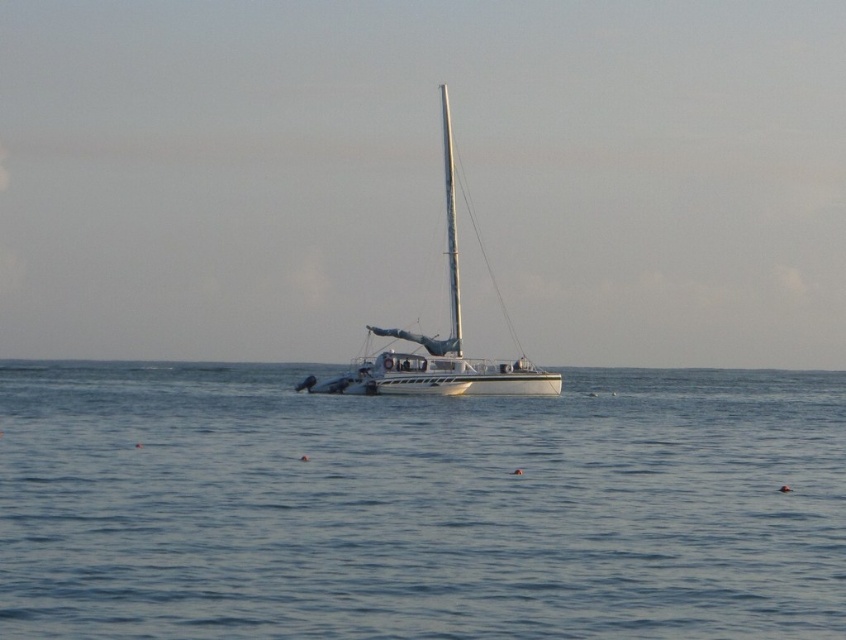
Does white glossy sailboat at center have a lesser width compared to white matte mast at center?

In fact, white glossy sailboat at center might be wider than white matte mast at center.

Does white glossy sailboat at center appear on the right side of white matte mast at center?

Correct, you'll find white glossy sailboat at center to the right of white matte mast at center.

Is point (465, 356) less distant than point (442, 88)?

Yes, it is in front of point (442, 88).

Locate an element on the screen. This screenshot has width=846, height=640. white glossy sailboat at center is located at coordinates (438, 339).

Which is above, blue water at center or white matte mast at center?

white matte mast at center is above.

Is blue water at center smaller than white matte mast at center?

Yes.

Where is `blue water at center`? blue water at center is located at coordinates (418, 506).

Between point (669, 588) and point (517, 372), which one is positioned in front?

Positioned in front is point (669, 588).

Is blue water at center positioned at the back of white glossy sailboat at center?

No, blue water at center is in front of white glossy sailboat at center.

Is point (438, 627) positioned before point (427, 378)?

Yes.

At what (x,y) coordinates should I click in order to perform the action: click on blue water at center. Please return your answer as a coordinate pair (x, y). The height and width of the screenshot is (640, 846). Looking at the image, I should click on (418, 506).